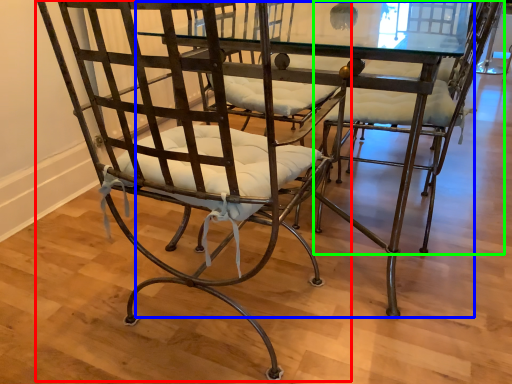
Question: Estimate the real-world distances between objects in this image. Which object is closer to chair (highlighted by a red box), round table (highlighted by a blue box) or chair (highlighted by a green box)?

Choices:
 (A) round table
 (B) chair

Answer: (A)